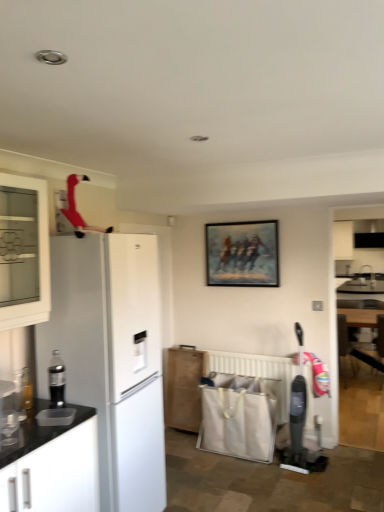
Question: In which direction should I rotate to look at wooden cabinet at lower center, positioned as the second cabinetry in top-to-bottom order?

Choices:
 (A) right
 (B) left

Answer: (B)

Question: Is wooden armchair at lower right surrounding white matte refrigerator at left?

Choices:
 (A) yes
 (B) no

Answer: (B)

Question: Would you consider wooden armchair at lower right to be distant from white matte refrigerator at left?

Choices:
 (A) no
 (B) yes

Answer: (B)

Question: Considering the relative sizes of wooden armchair at lower right and white matte refrigerator at left in the image provided, is wooden armchair at lower right taller than white matte refrigerator at left?

Choices:
 (A) no
 (B) yes

Answer: (A)

Question: From the image's perspective, is wooden armchair at lower right on top of white matte refrigerator at left?

Choices:
 (A) yes
 (B) no

Answer: (B)

Question: From a real-world perspective, is wooden armchair at lower right over white matte refrigerator at left?

Choices:
 (A) yes
 (B) no

Answer: (B)

Question: Considering the relative positions of wooden armchair at lower right and white matte refrigerator at left in the image provided, is wooden armchair at lower right to the left of white matte refrigerator at left from the viewer's perspective?

Choices:
 (A) yes
 (B) no

Answer: (B)

Question: Does white glass cabinet at left, which is the first cabinetry from top to bottom, have a smaller size compared to wooden armchair at lower right?

Choices:
 (A) no
 (B) yes

Answer: (B)

Question: Considering the relative sizes of white glass cabinet at left, the 1th cabinetry when ordered from front to back, and wooden armchair at lower right in the image provided, is white glass cabinet at left, the 1th cabinetry when ordered from front to back, bigger than wooden armchair at lower right?

Choices:
 (A) yes
 (B) no

Answer: (B)

Question: From a real-world perspective, is white glass cabinet at left, which is the first cabinetry from top to bottom, beneath wooden armchair at lower right?

Choices:
 (A) yes
 (B) no

Answer: (B)

Question: Does white glass cabinet at left, which is the first cabinetry from top to bottom, turn towards wooden armchair at lower right?

Choices:
 (A) yes
 (B) no

Answer: (B)

Question: Is white glass cabinet at left, the first cabinetry when ordered from left to right, shorter than wooden armchair at lower right?

Choices:
 (A) yes
 (B) no

Answer: (A)

Question: Is white glass cabinet at left, which appears as the second cabinetry when viewed from the back, outside wooden armchair at lower right?

Choices:
 (A) yes
 (B) no

Answer: (A)

Question: Does white plastic radiator at lower center lie behind wooden armchair at lower right?

Choices:
 (A) yes
 (B) no

Answer: (B)